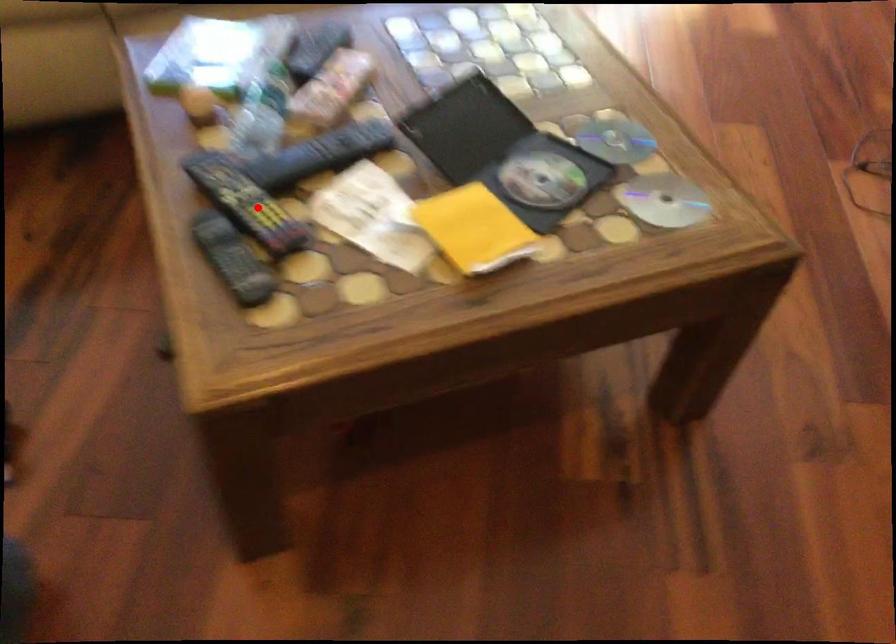
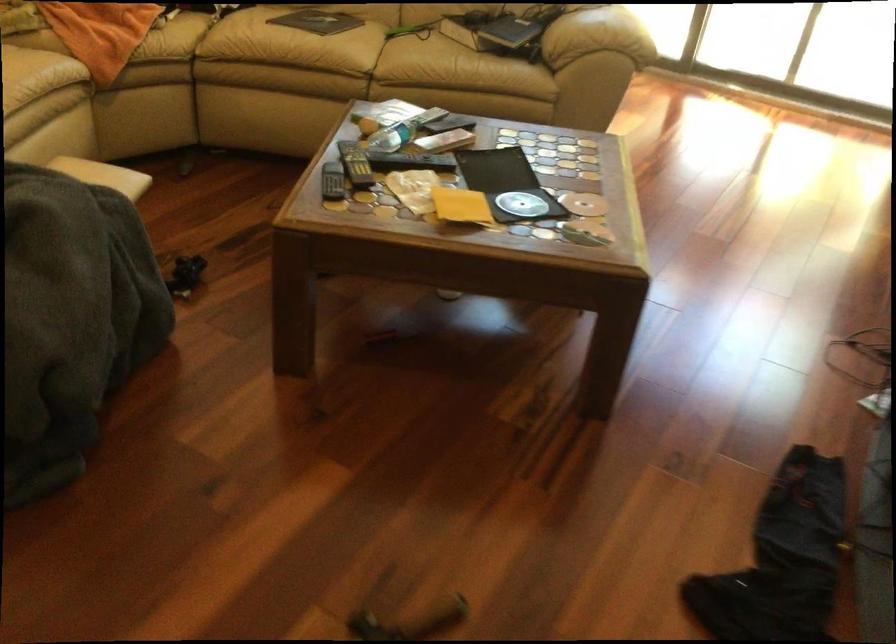
Where in the second image is the point corresponding to the highlighted location from the first image?

(355, 164)